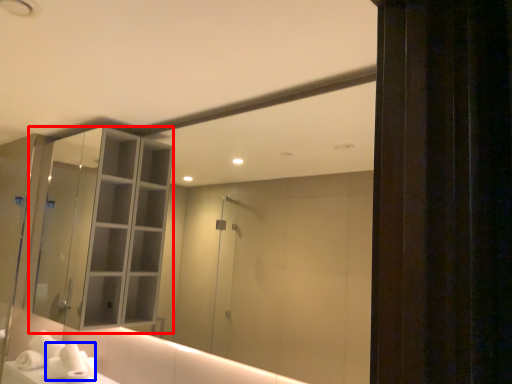
Question: Which object appears closest to the camera in this image, cabinetry (highlighted by a red box) or hand towel (highlighted by a blue box)?

Choices:
 (A) cabinetry
 (B) hand towel

Answer: (A)